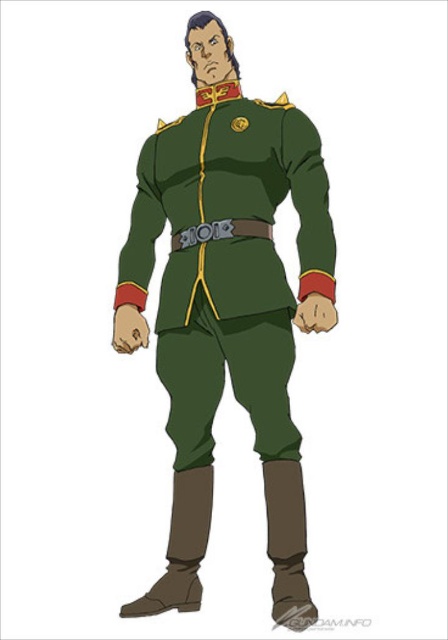
This screenshot has height=640, width=448. Describe the element at coordinates (228, 307) in the screenshot. I see `green matte uniform at center` at that location.

Between green matte uniform at center and green leather belt at center, which one has less height?

Standing shorter between the two is green leather belt at center.

Is point (199, 280) positioned in front of point (241, 218)?

Yes, point (199, 280) is closer to viewer.

Identify the location of green matte uniform at center. This screenshot has width=448, height=640. (228, 307).